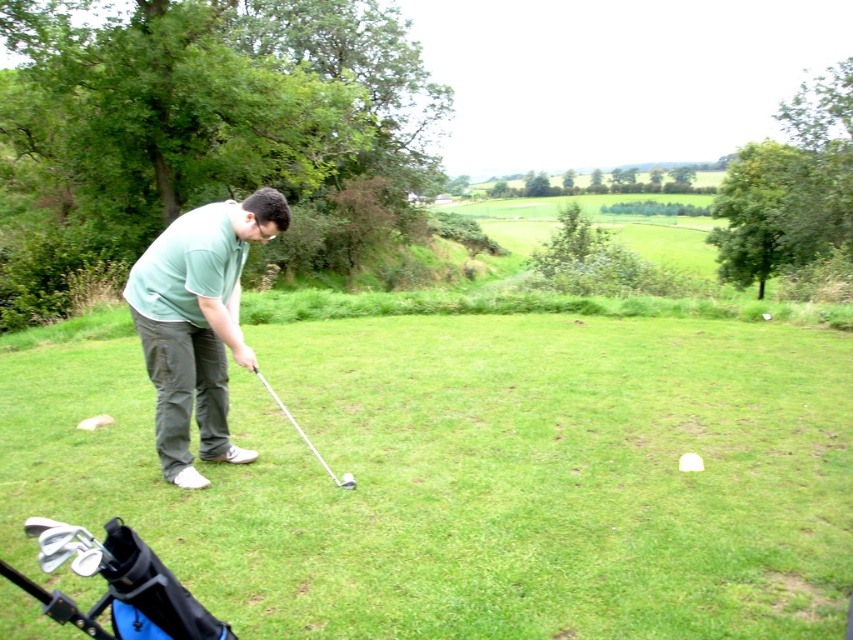
You are a golfer standing at the point with coordinates point (161, 384). You want to hit the golf ball to the hole located at point (343, 483). Which direction should you aim your shot?

You should aim towards point (343, 483) because it is behind point (161, 384), so the hole is in that direction.

You are a photographer taking a picture of the green matte shirt at center and the white matte golf at center. Which object should you focus on first if you want to ensure both are in sharp focus, considering their sizes?

The green matte shirt at center is bigger than the white matte golf at center, so you should focus on the green matte shirt at center first to ensure both are in sharp focus.

You are a golf instructor observing a student practicing their swing. You notice the white matte golf at center and the shiny silver golf club at center. Based on their positions, can you determine if the golf ball is in the air during the swing?

The white matte golf at center is above the shiny silver golf club at center, which indicates that the golf ball is in the air during the swing.